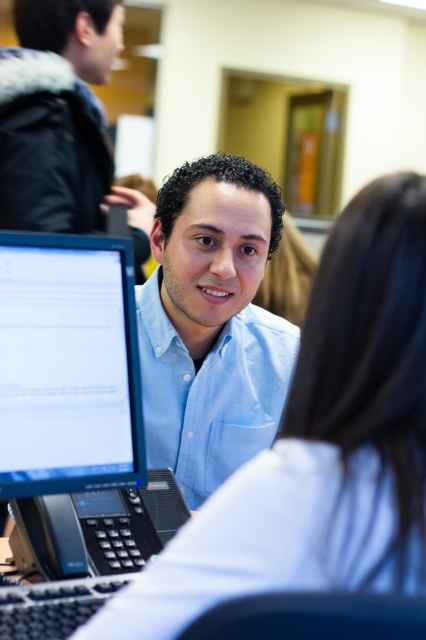
You are an office worker who needs to choose a shirt to wear for a meeting. You see the white fabric shirt at center and the matte blue shirt at center in the office. Which shirt is shorter in length?

The white fabric shirt at center is shorter than the matte blue shirt at center, so the white fabric shirt at center is the shorter one.

You are an office assistant who needs to place a new document organizer between the matte black monitor at left and the matte blue shirt at center. Given that the organizer requires 20 cm of space, can you fit it between them based on their sizes?

The matte black monitor at left occupies less space than matte blue shirt at center. However, without knowing the exact distance between them, it is impossible to determine if the 20 cm organizer will fit. Please measure the space first.

You are an office assistant who needs to identify the correct shirt for a meeting. The meeting requires the taller shirt. Which one should you choose between the light blue shirt at center and the matte blue shirt at center?

The light blue shirt at center is much taller than the matte blue shirt at center, so you should choose the light blue shirt at center for the meeting.